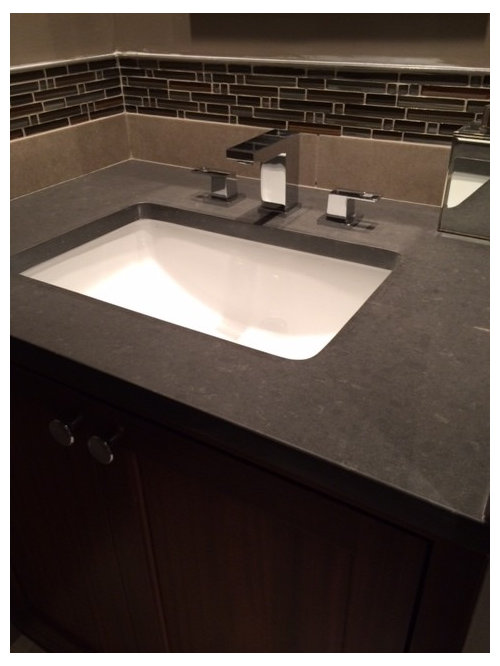
What are the coordinates of `backsplash on wall` in the screenshot? It's located at (60, 100), (345, 95).